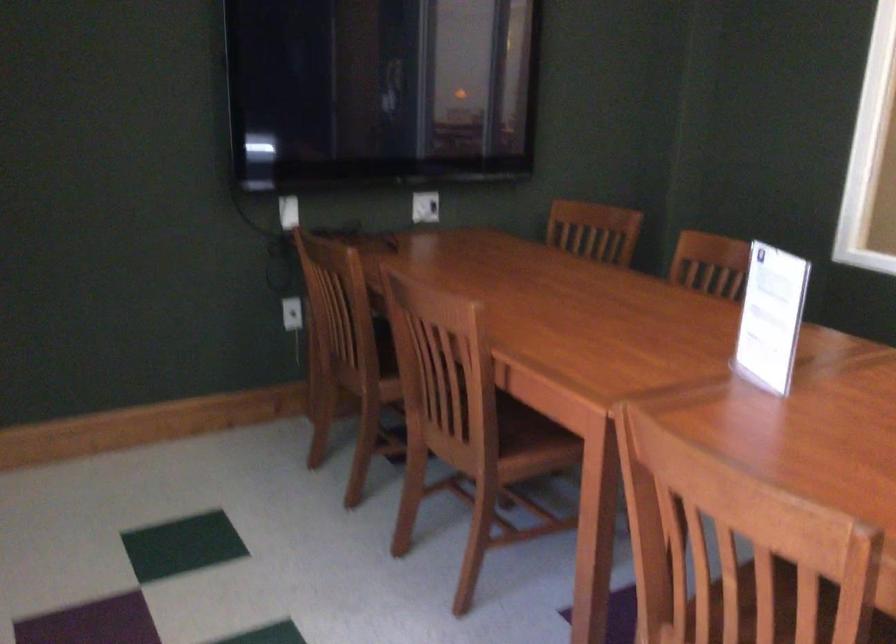
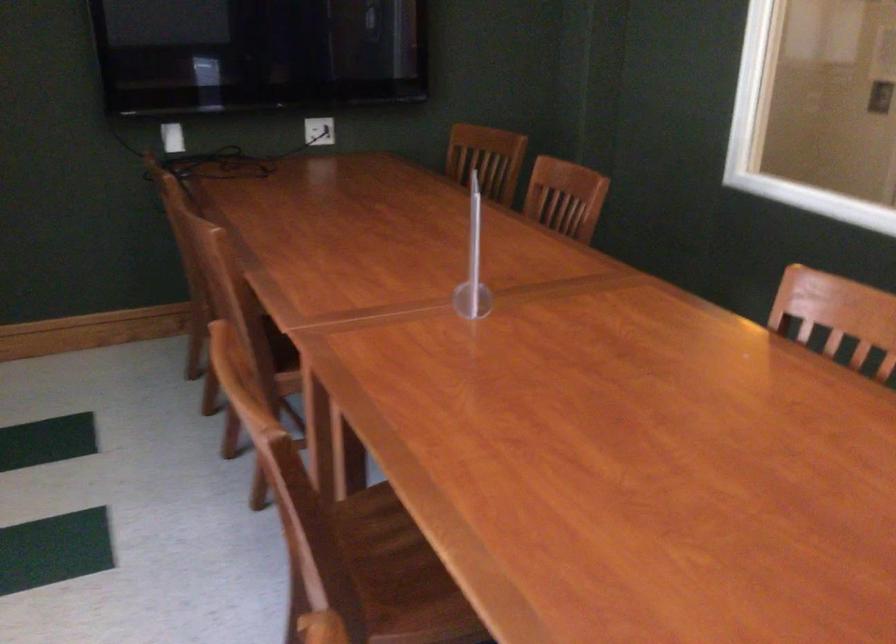
Where in the second image is the point corresponding to point (470, 315) from the first image?

(216, 242)